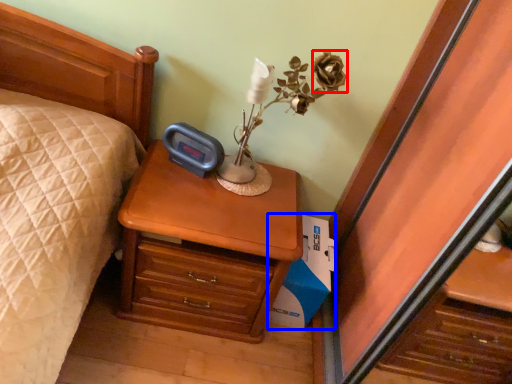
Question: Which point is further to the camera, flower (highlighted by a red box) or cardboard box (highlighted by a blue box)?

Choices:
 (A) flower
 (B) cardboard box

Answer: (B)